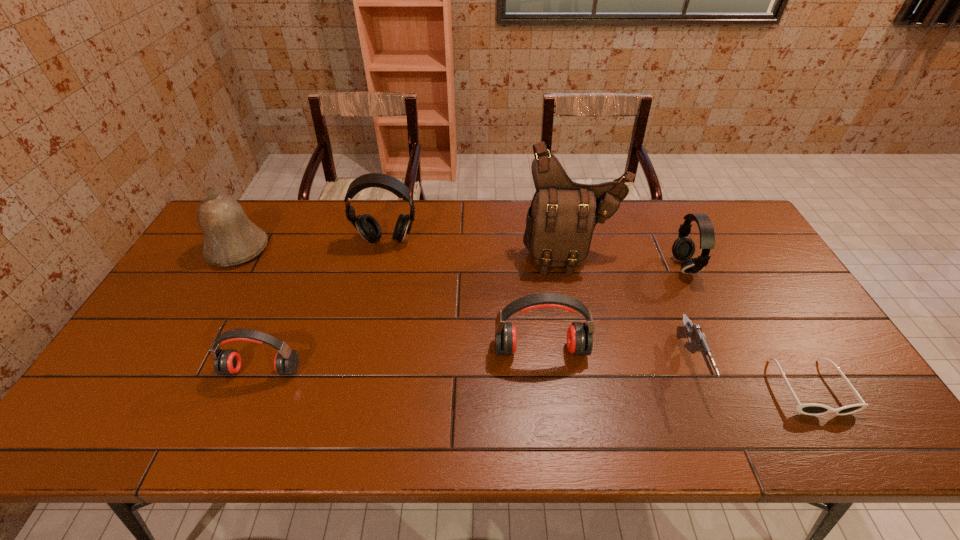
I want to click on vacant area located 0.390m on the ear cups of the right black earphone, so click(x=547, y=266).

Locate an element on the screen. The width and height of the screenshot is (960, 540). blank space located 0.240m on the ear cups of the right black earphone is located at coordinates (595, 266).

This screenshot has height=540, width=960. What are the coordinates of `vacant area situated 0.120m on the ear cups of the smaller red earphone` in the screenshot? It's located at (239, 427).

You are a GUI agent. You are given a task and a screenshot of the screen. Output one action in this format:
    pyautogui.click(x=<x>, y=<y>)
    Task: Click on the free space located 0.100m at the barrel of the sixth object from left to right
    
    Given the screenshot: What is the action you would take?
    pyautogui.click(x=720, y=441)

The width and height of the screenshot is (960, 540). In order to click on shoulder bag situated at the far edge in this screenshot , I will do `click(560, 222)`.

You are a GUI agent. You are given a task and a screenshot of the screen. Output one action in this format:
    pyautogui.click(x=<x>, y=<y>)
    Task: Click on the earphone present at the far edge
    The image size is (960, 540).
    Given the screenshot: What is the action you would take?
    pyautogui.click(x=368, y=227)

Where is `bell that is at the far edge`? Image resolution: width=960 pixels, height=540 pixels. bell that is at the far edge is located at coordinates (230, 238).

The width and height of the screenshot is (960, 540). What are the coordinates of `object that is positioned at the near edge` in the screenshot? It's located at (810, 408).

Find the location of a particular element. The width and height of the screenshot is (960, 540). object at the left edge is located at coordinates pos(230,238).

The height and width of the screenshot is (540, 960). What are the coordinates of `object present at the right edge` in the screenshot? It's located at (810, 408).